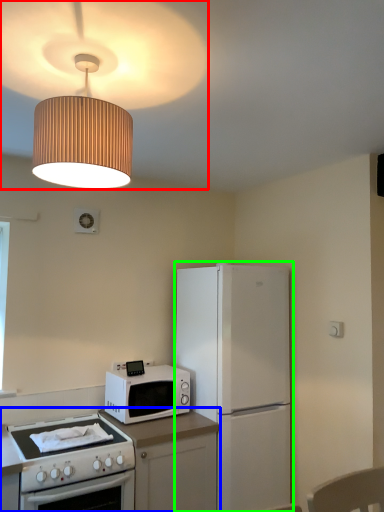
Question: Which object is the closest to the lamp (highlighted by a red box)? Choose among these: countertop (highlighted by a blue box) or refrigerator (highlighted by a green box).

Choices:
 (A) countertop
 (B) refrigerator

Answer: (B)